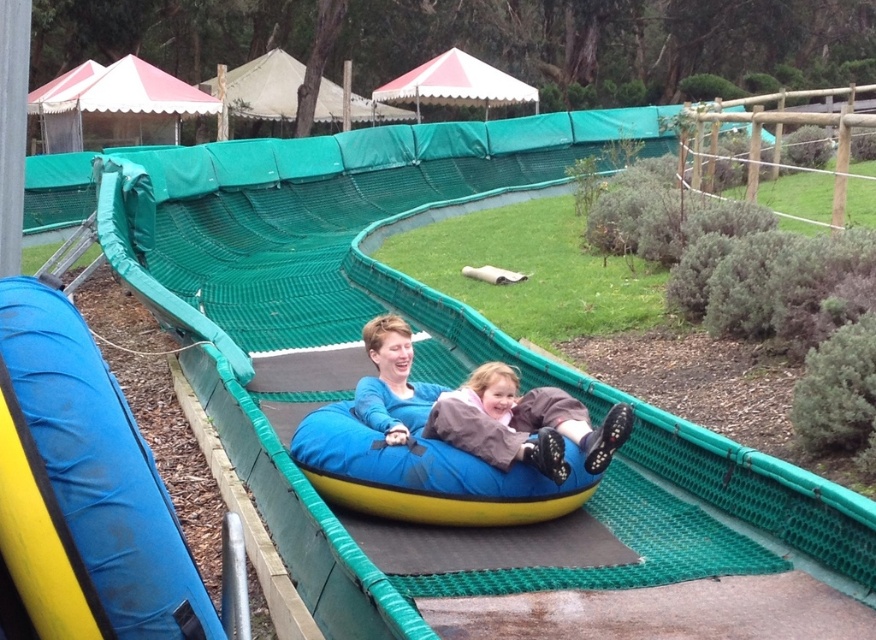
You are a park visitor who wants to take a photo of the brown fuzzy pants at center and the blue rubber slide at center. Which object should you point your camera towards first if you are standing to the right of both objects?

Since the blue rubber slide at center is to the left of brown fuzzy pants at center, if you are standing to the right of both objects, you should point your camera towards the brown fuzzy pants at center first because it is closer to your right side.

You are at an amusement park and want to take a photo of the blue rubber tube at center and the blue matte sweater at center. Which object should you focus on first if you want to capture both in the same frame without moving the camera?

You should focus on the blue rubber tube at center first because it is to the right of the blue matte sweater at center, so adjusting focus to the right ensures both are in frame.

You are a photographer trying to capture a clear photo of both the brown fuzzy pants at center and the blue matte sweater at center. Which object should you focus on first to ensure both are in focus?

You should focus on the brown fuzzy pants at center first because it might be wider than the blue matte sweater at center, so focusing on the wider object ensures both will be in focus.